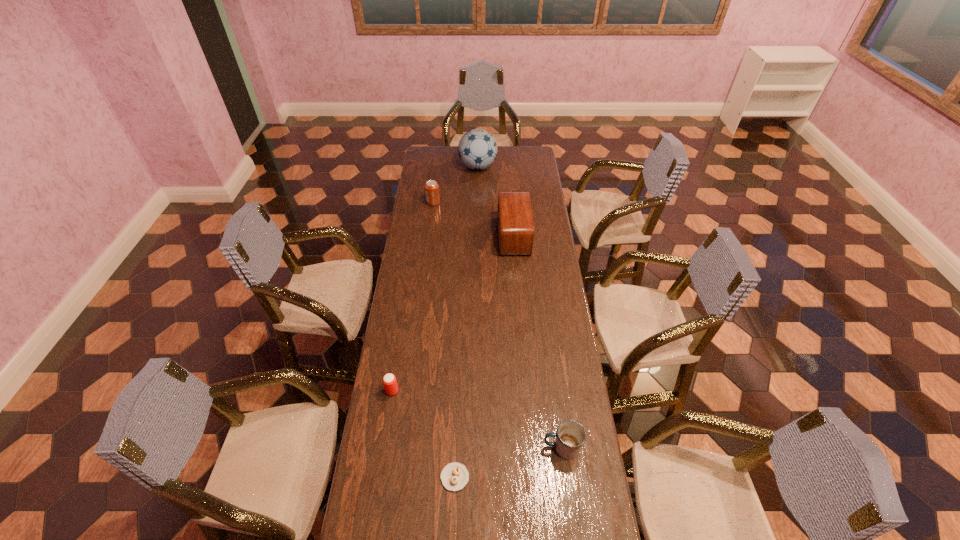
This screenshot has width=960, height=540. In order to click on the tallest object in this screenshot , I will do `click(477, 149)`.

Find the location of `soccer ball`. soccer ball is located at coordinates (477, 149).

Locate an element on the screen. Image resolution: width=960 pixels, height=540 pixels. the third farthest object is located at coordinates (515, 220).

Find the location of a particular element. This screenshot has width=960, height=540. the second tallest object is located at coordinates (515, 220).

Where is `the second farthest object`? the second farthest object is located at coordinates (432, 193).

You are a GUI agent. You are given a task and a screenshot of the screen. Output one action in this format:
    pyautogui.click(x=<x>, y=<y>)
    Task: Click on the can
    The image size is (960, 540).
    Given the screenshot: What is the action you would take?
    pyautogui.click(x=432, y=193)

Image resolution: width=960 pixels, height=540 pixels. What are the coordinates of `the fourth tallest object` in the screenshot? It's located at (571, 435).

Identify the location of the second nearest object. (571, 435).

The width and height of the screenshot is (960, 540). I want to click on the third nearest object, so click(389, 380).

In order to click on the leftmost object in this screenshot , I will do `click(389, 380)`.